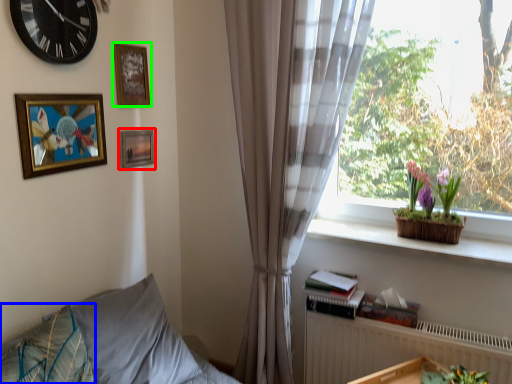
Question: Which is nearer to the picture frame (highlighted by a red box)? pillow (highlighted by a blue box) or picture frame (highlighted by a green box).

Choices:
 (A) pillow
 (B) picture frame

Answer: (B)